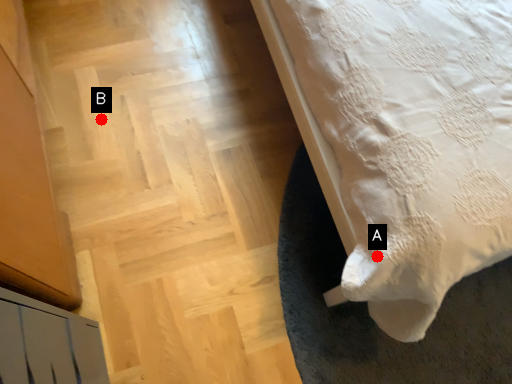
Question: Two points are circled on the image, labeled by A and B beside each circle. Which point appears closest to the camera in this image?

Choices:
 (A) A is closer
 (B) B is closer

Answer: (A)